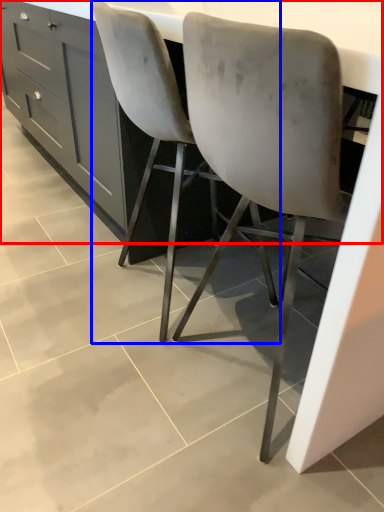
Question: Which of the following is the closest to the observer, counter (highlighted by a red box) or chair (highlighted by a blue box)?

Choices:
 (A) counter
 (B) chair

Answer: (A)